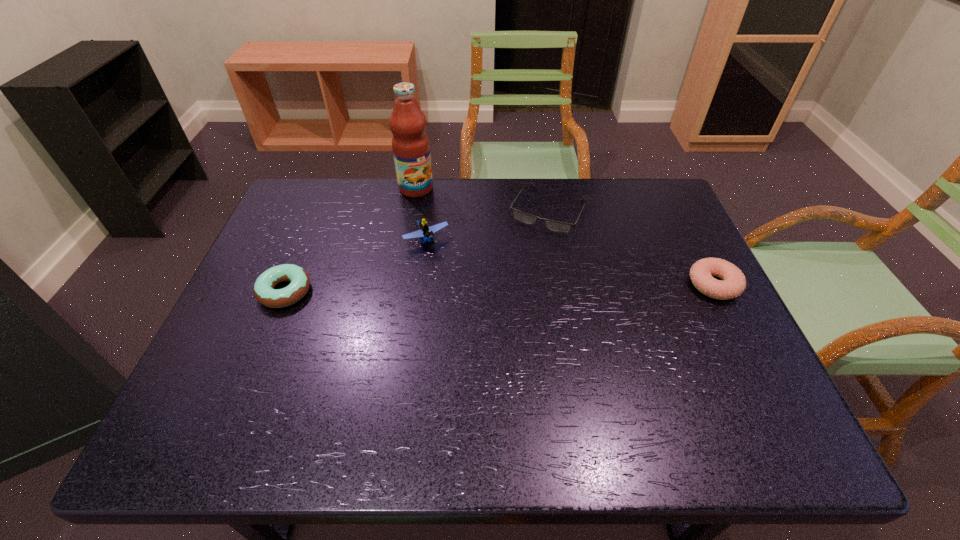
Locate an element on the screen. The height and width of the screenshot is (540, 960). blank region between the fourth object from left to right and the tallest object is located at coordinates (482, 200).

Locate an element on the screen. blank region between the second object from right to left and the rightmost object is located at coordinates (631, 248).

I want to click on vacant area that lies between the tallest object and the spectacles, so 482,200.

This screenshot has width=960, height=540. I want to click on vacant area that lies between the Lego and the leftmost object, so pyautogui.click(x=356, y=266).

Locate an element on the screen. This screenshot has width=960, height=540. vacant area that lies between the Lego and the left doughnut is located at coordinates (356, 266).

This screenshot has height=540, width=960. Identify the location of free space that is in between the left doughnut and the second object from right to left. (417, 251).

Identify which object is the third nearest to the tallest object. Please provide its 2D coordinates. Your answer should be formatted as a tuple, i.e. [(x, y)], where the tuple contains the x and y coordinates of a point satisfying the conditions above.

[(264, 291)]

This screenshot has width=960, height=540. Identify the location of the closest object to the fruit juice. (425, 233).

You are a GUI agent. You are given a task and a screenshot of the screen. Output one action in this format:
    pyautogui.click(x=<x>, y=<y>)
    Task: Click on the vacant region that satisfies the following two spatial constraints: 1. on the back side of the second tallest object; 2. on the right side of the spectacles
    
    Given the screenshot: What is the action you would take?
    pyautogui.click(x=430, y=211)